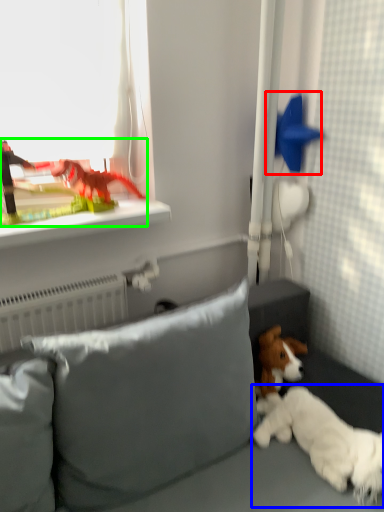
Question: Which is farther away from toy (highlighted by a red box)? dog (highlighted by a blue box) or toy (highlighted by a green box)?

Choices:
 (A) dog
 (B) toy

Answer: (A)